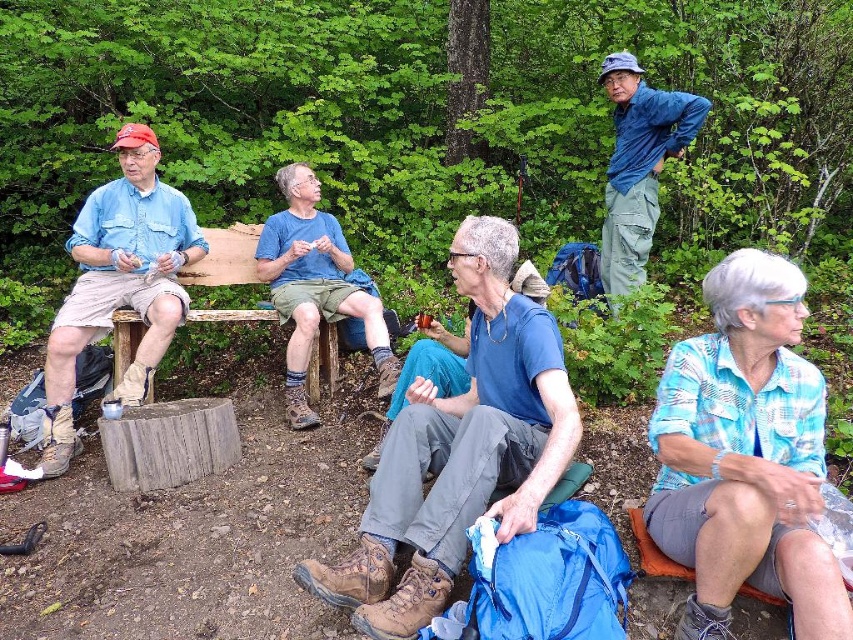
You are a photographer trying to capture a group photo of the hikers. You notice two blue shirts in the scene. Which one of the blue cotton shirt at center and the blue fabric shirt at upper right should you focus on to ensure it appears larger in the photo?

The blue cotton shirt at center should be focused on because it is much taller than the blue fabric shirt at upper right, making it appear larger in the photo.

What is located at the coordinate point (119, 284) in the image?

At point (119, 284) lies matte blue shirt at left.

You are a photographer trying to capture a group photo of the hikers. You notice two blue shirts in the scene. Which blue shirt, the blue plaid shirt at lower right or the blue fabric shirt at upper right, is located to the left of the other?

The blue plaid shirt at lower right is positioned on the left side of the blue fabric shirt at upper right.